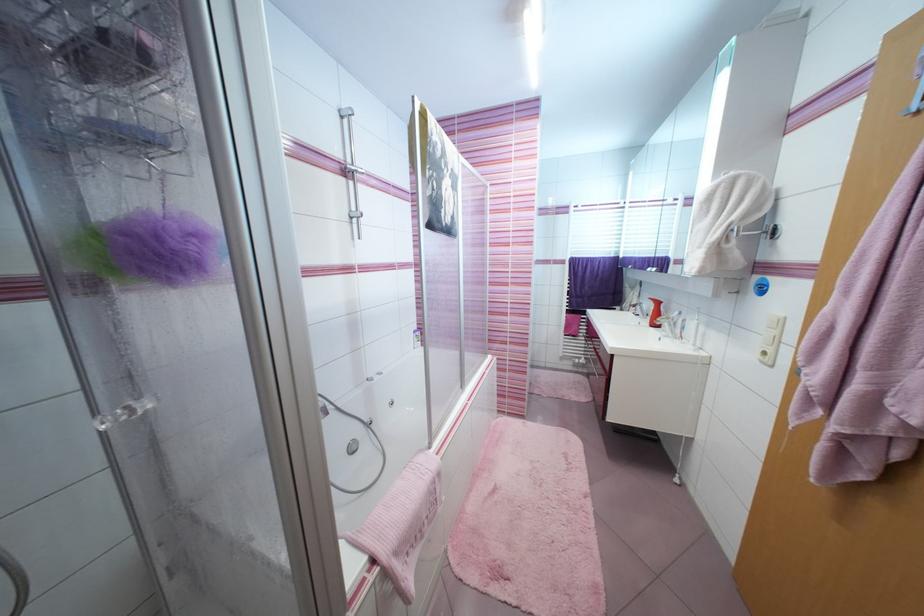
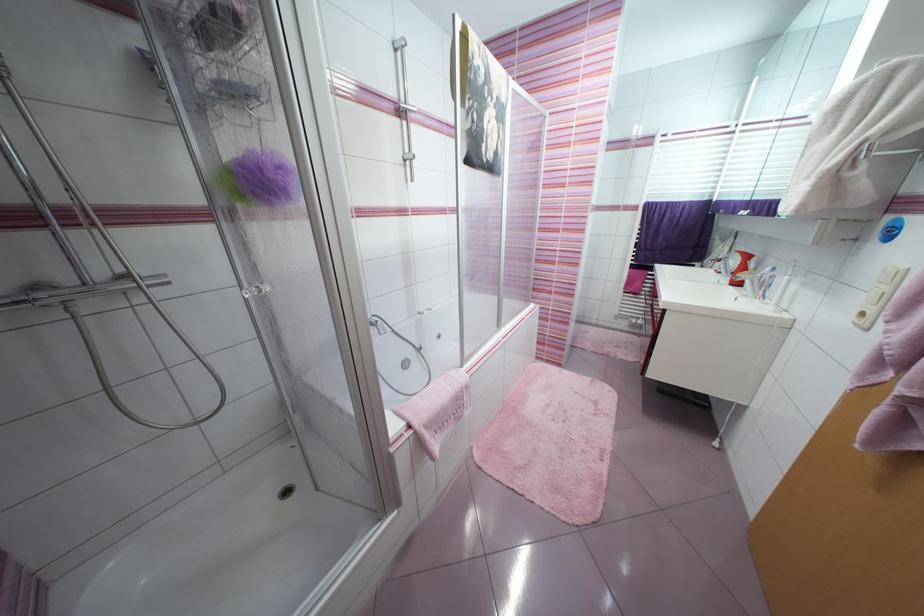
What movement of the cameraman would produce the second image?

The cameraman moved toward right, backward.